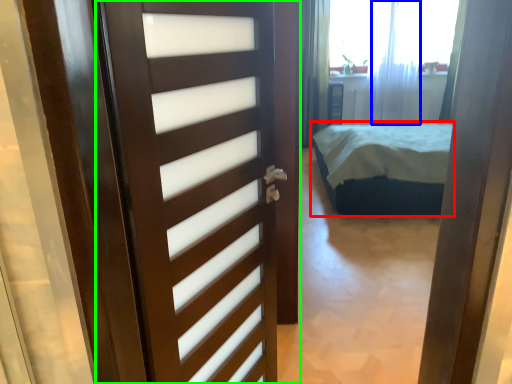
Question: Estimate the real-world distances between objects in this image. Which object is farther from bed (highlighted by a red box), curtain (highlighted by a blue box) or door (highlighted by a green box)?

Choices:
 (A) curtain
 (B) door

Answer: (B)